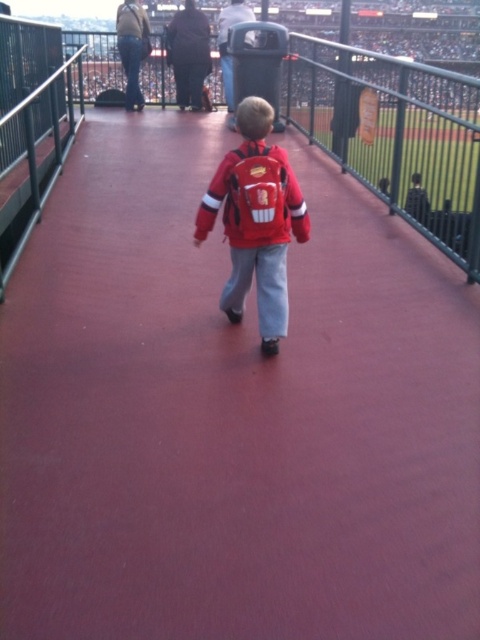
You are a photographer positioned at the camera. You want to capture a photo of the child such that both the matte red backpack at center and the matte red jacket at center are clearly visible in the frame. Given the distance between them, will you need to adjust your camera angle to ensure both objects are in focus?

The distance between the matte red backpack at center and the matte red jacket at center is 3.02 inches, which is very small. Therefore, you do not need to adjust the camera angle significantly to keep both objects in focus as they are close together.